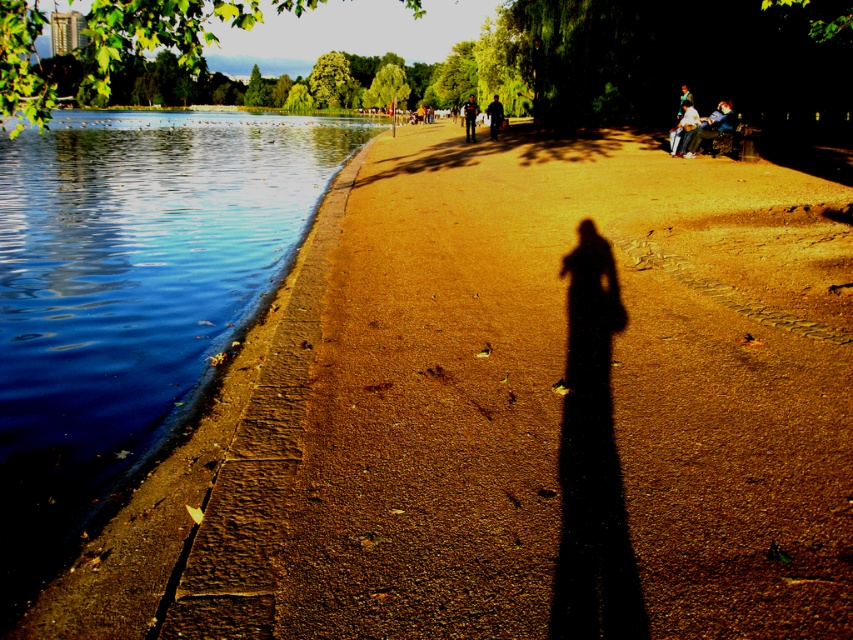
Question: Where is blue smooth water at left located in relation to blue denim jeans at upper right in the image?

Choices:
 (A) left
 (B) right

Answer: (A)

Question: Among these points, which one is nearest to the camera?

Choices:
 (A) (97, 132)
 (B) (693, 145)
 (C) (492, 109)
 (D) (677, 115)

Answer: (B)

Question: Does blue denim jeans at upper right appear on the left side of dark brown leather jacket at center?

Choices:
 (A) yes
 (B) no

Answer: (B)

Question: Which of the following is the closest to the observer?

Choices:
 (A) blue denim jeans at upper right
 (B) blue smooth water at left

Answer: (B)

Question: Among these objects, which one is nearest to the camera?

Choices:
 (A) blue denim jeans at upper right
 (B) blue denim jeans at right
 (C) dark blue jeans at center

Answer: (A)

Question: From the image, what is the correct spatial relationship of white cotton shirt at upper right in relation to dark brown leather jacket at center?

Choices:
 (A) below
 (B) above

Answer: (A)